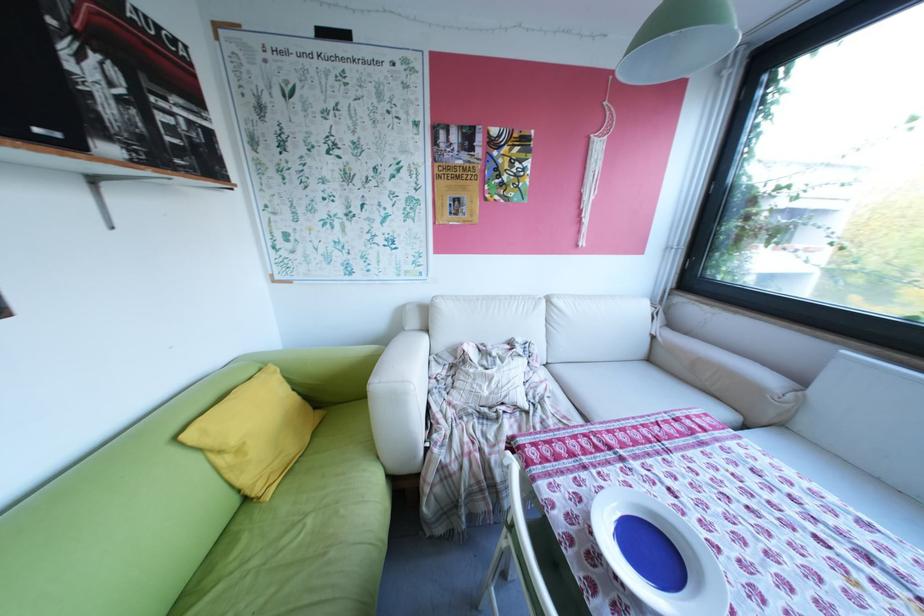
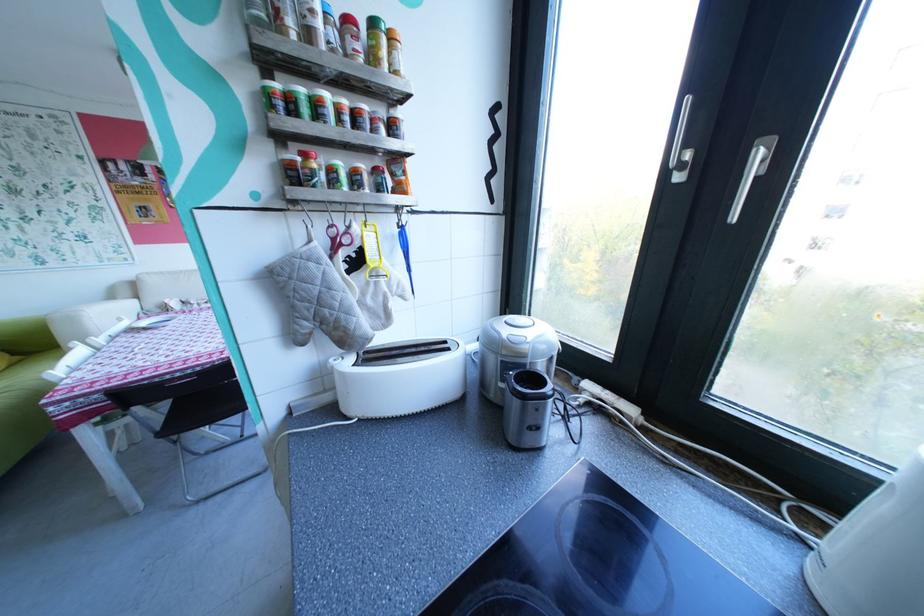
What movement of the cameraman would produce the second image?

The movement direction of the cameraman is right, backward.